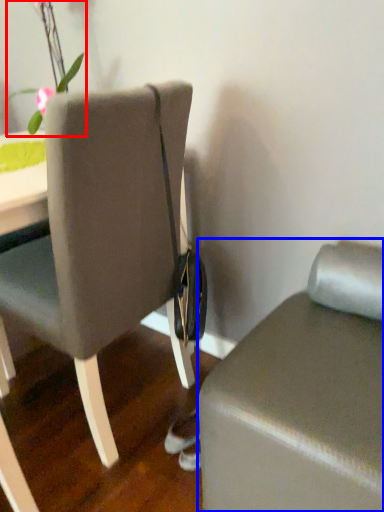
Question: Which object appears closest to the camera in this image, floral arrangement (highlighted by a red box) or furniture (highlighted by a blue box)?

Choices:
 (A) floral arrangement
 (B) furniture

Answer: (B)